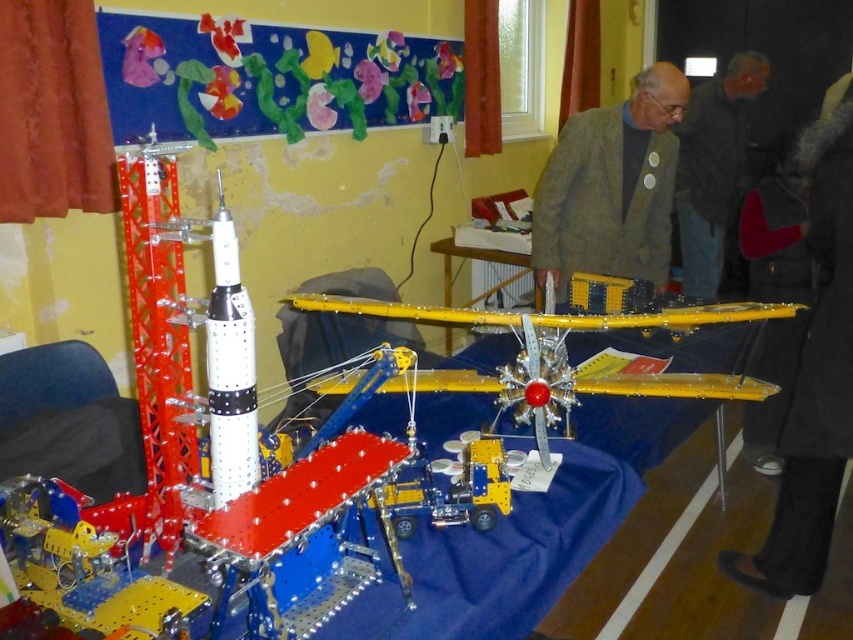
Question: Which point is farther to the camera?

Choices:
 (A) (718, 397)
 (B) (799, 369)
 (C) (253, 346)
 (D) (648, 275)

Answer: (D)

Question: Which of these objects is positioned farthest from the yellow metallic airplane at center?

Choices:
 (A) white metallic rocket at center
 (B) dark brown leather jacket at upper right
 (C) green textured blazer at center
 (D) black fabric at lower right

Answer: (B)

Question: Which point is closer to the camera?

Choices:
 (A) white metallic rocket at center
 (B) yellow plastic table at center
 (C) black fabric at lower right

Answer: (A)

Question: Is green textured blazer at center above yellow metallic airplane at center?

Choices:
 (A) yes
 (B) no

Answer: (A)

Question: Is green textured blazer at center bigger than white metallic rocket at center?

Choices:
 (A) yes
 (B) no

Answer: (A)

Question: In this image, where is black fabric at lower right located relative to dark brown leather jacket at upper right?

Choices:
 (A) below
 (B) above

Answer: (A)